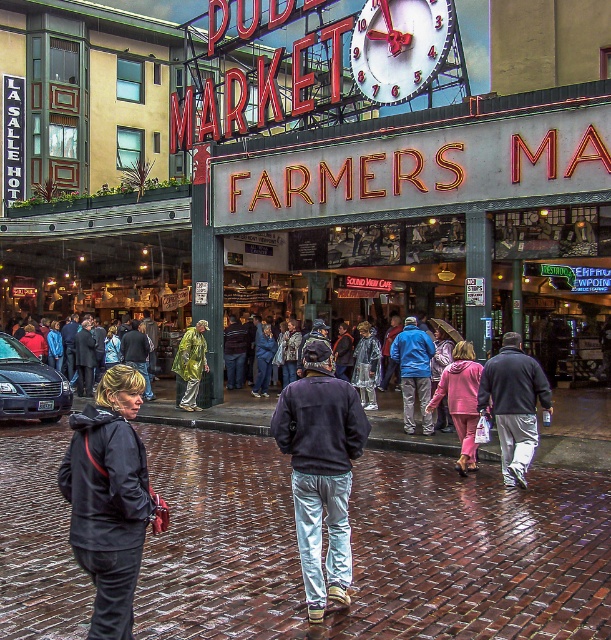
Can you confirm if dark blue sweatshirt at center is positioned below raincoat at center?

Indeed, dark blue sweatshirt at center is positioned under raincoat at center.

Is point (323, 365) more distant than point (183, 397)?

No, (323, 365) is closer to viewer.

The image size is (611, 640). Find the location of `dark blue sweatshirt at center`. dark blue sweatshirt at center is located at coordinates (320, 468).

Which of these two, gray sweatpants at center or pink fleece jacket at center, stands taller?

Answer: gray sweatpants at center

Is gray sweatpants at center further to camera compared to pink fleece jacket at center?

That is False.

Which is behind, point (516, 444) or point (452, 381)?

The point (452, 381) is more distant.

You are a GUI agent. You are given a task and a screenshot of the screen. Output one action in this format:
    pyautogui.click(x=<x>, y=<y>)
    Task: Click on the gray sweatpants at center
    
    Given the screenshot: What is the action you would take?
    pyautogui.click(x=514, y=404)

Who is taller, wet brick pavement at center or raincoat fabric crowd at center?

raincoat fabric crowd at center

Who is shorter, wet brick pavement at center or raincoat fabric crowd at center?

wet brick pavement at center

Is point (540, 595) closer to camera compared to point (180, 413)?

Yes, it is in front of point (180, 413).

Find the location of a particular element. wet brick pavement at center is located at coordinates (370, 547).